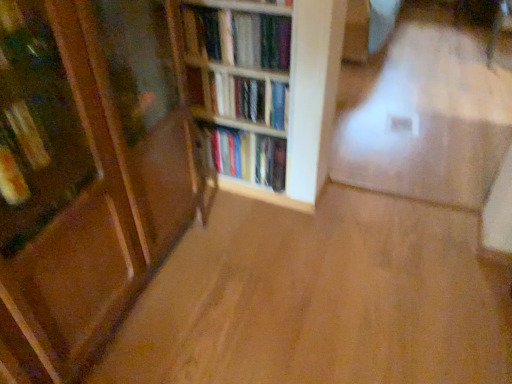
Question: Is wooden bookshelf at center directly adjacent to hardcover books at center, the second book in the bottom-to-top sequence?

Choices:
 (A) yes
 (B) no

Answer: (B)

Question: Considering the relative positions of wooden bookshelf at center and hardcover books at center, the second book in the top-to-bottom sequence, in the image provided, is wooden bookshelf at center to the right of hardcover books at center, the second book in the top-to-bottom sequence, from the viewer's perspective?

Choices:
 (A) no
 (B) yes

Answer: (A)

Question: From a real-world perspective, is wooden bookshelf at center over hardcover books at center, the second book in the top-to-bottom sequence?

Choices:
 (A) no
 (B) yes

Answer: (A)

Question: From a real-world perspective, is wooden bookshelf at center beneath hardcover books at center, the second book in the top-to-bottom sequence?

Choices:
 (A) yes
 (B) no

Answer: (A)

Question: Does wooden bookshelf at center contain hardcover books at center, the second book in the top-to-bottom sequence?

Choices:
 (A) no
 (B) yes

Answer: (B)

Question: Is wooden bookshelf at center, which ranks as the first book in top-to-bottom order, bigger or smaller than wooden bookshelf at center?

Choices:
 (A) big
 (B) small

Answer: (B)

Question: Is wooden bookshelf at center, which ranks as the first book in top-to-bottom order, wider or thinner than wooden bookshelf at center?

Choices:
 (A) wide
 (B) thin

Answer: (A)

Question: Is point (263, 61) closer or farther from the camera than point (321, 8)?

Choices:
 (A) farther
 (B) closer

Answer: (A)

Question: From their relative heights in the image, would you say wooden bookshelf at center, which ranks as the first book in top-to-bottom order, is taller or shorter than wooden bookshelf at center?

Choices:
 (A) tall
 (B) short

Answer: (B)

Question: In terms of size, does hardcover books at center, the second book in the bottom-to-top sequence, appear bigger or smaller than hardcover books at center, which is counted as the third book, starting from the top?

Choices:
 (A) small
 (B) big

Answer: (A)

Question: In terms of width, does hardcover books at center, the second book in the bottom-to-top sequence, look wider or thinner when compared to hardcover books at center, which is counted as the third book, starting from the top?

Choices:
 (A) thin
 (B) wide

Answer: (A)

Question: Visually, is hardcover books at center, the second book in the top-to-bottom sequence, positioned to the left or to the right of hardcover books at center, which is counted as the third book, starting from the top?

Choices:
 (A) right
 (B) left

Answer: (B)

Question: Does point (265, 97) appear closer or farther from the camera than point (228, 140)?

Choices:
 (A) farther
 (B) closer

Answer: (B)

Question: Considering the positions of hardcover books at center, which is counted as the third book, starting from the top, and wooden bookshelf at center, which ranks as the first book in top-to-bottom order, in the image, is hardcover books at center, which is counted as the third book, starting from the top, taller or shorter than wooden bookshelf at center, which ranks as the first book in top-to-bottom order,?

Choices:
 (A) short
 (B) tall

Answer: (B)

Question: Considering the positions of point (237, 139) and point (267, 62), is point (237, 139) closer or farther from the camera than point (267, 62)?

Choices:
 (A) closer
 (B) farther

Answer: (B)